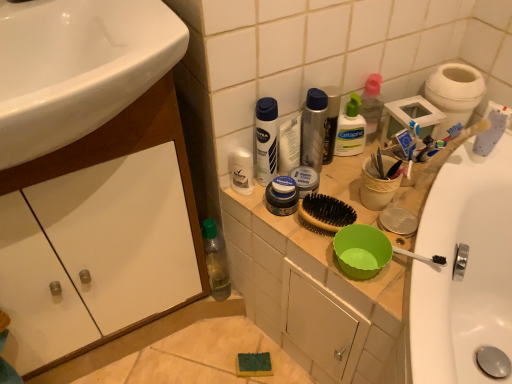
Question: Considering the relative sizes of metallic silver deodorant at upper center, the 3th toiletry viewed from the left, and white glossy deodorant at center, which is counted as the 1th toiletry, starting from the left, in the image provided, is metallic silver deodorant at upper center, the 3th toiletry viewed from the left, smaller than white glossy deodorant at center, which is counted as the 1th toiletry, starting from the left,?

Choices:
 (A) no
 (B) yes

Answer: (A)

Question: Is metallic silver deodorant at upper center, the 3th toiletry viewed from the left, turned away from white glossy deodorant at center, which is counted as the 1th toiletry, starting from the left?

Choices:
 (A) yes
 (B) no

Answer: (B)

Question: Can you confirm if metallic silver deodorant at upper center, acting as the 2th toiletry starting from the right, is shorter than white glossy deodorant at center, which is counted as the 1th toiletry, starting from the left?

Choices:
 (A) yes
 (B) no

Answer: (B)

Question: Is metallic silver deodorant at upper center, acting as the 2th toiletry starting from the right, far away from white glossy deodorant at center, which is counted as the 1th toiletry, starting from the left?

Choices:
 (A) yes
 (B) no

Answer: (B)

Question: Does metallic silver deodorant at upper center, the 3th toiletry viewed from the left, have a greater width compared to white glossy deodorant at center, the 4th toiletry from the right?

Choices:
 (A) yes
 (B) no

Answer: (A)

Question: Could you tell me if metallic silver deodorant at upper center, the 3th toiletry viewed from the left, is turned towards white glossy deodorant at center, the 4th toiletry from the right?

Choices:
 (A) yes
 (B) no

Answer: (B)

Question: Considering the relative sizes of matte plastic toiletries at upper right and matte silver container at center, acting as the second toiletry starting from the left, in the image provided, is matte plastic toiletries at upper right bigger than matte silver container at center, acting as the second toiletry starting from the left,?

Choices:
 (A) yes
 (B) no

Answer: (A)

Question: Considering the relative sizes of matte plastic toiletries at upper right and matte silver container at center, acting as the second toiletry starting from the left, in the image provided, is matte plastic toiletries at upper right shorter than matte silver container at center, acting as the second toiletry starting from the left,?

Choices:
 (A) no
 (B) yes

Answer: (A)

Question: Is matte plastic toiletries at upper right facing away from matte silver container at center, acting as the second toiletry starting from the left?

Choices:
 (A) no
 (B) yes

Answer: (A)

Question: Can you confirm if matte plastic toiletries at upper right is smaller than matte silver container at center, acting as the second toiletry starting from the left?

Choices:
 (A) yes
 (B) no

Answer: (B)

Question: Can you confirm if matte plastic toiletries at upper right is thinner than matte silver container at center, acting as the second toiletry starting from the left?

Choices:
 (A) yes
 (B) no

Answer: (B)

Question: Could matte silver container at center, acting as the second toiletry starting from the left, be considered to be inside matte plastic toiletries at upper right?

Choices:
 (A) no
 (B) yes

Answer: (A)

Question: Is white glossy cabinet at lower left wider than metallic silver deodorant at upper center, acting as the 2th toiletry starting from the right?

Choices:
 (A) yes
 (B) no

Answer: (A)